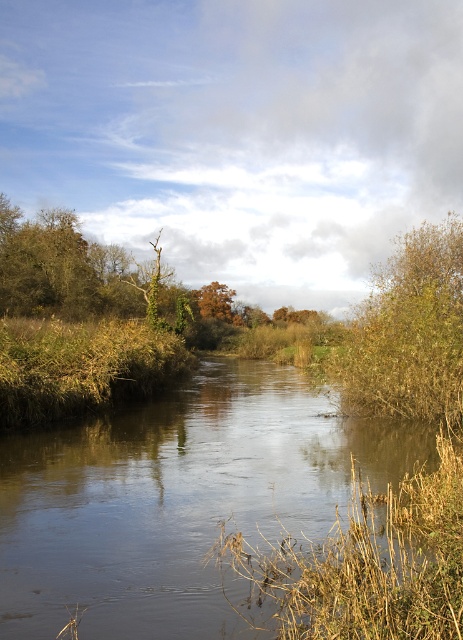
Question: Does brown textured bush at right appear over orange matte tree at center?

Choices:
 (A) yes
 (B) no

Answer: (B)

Question: Is brown textured bush at right smaller than orange matte tree at center?

Choices:
 (A) no
 (B) yes

Answer: (A)

Question: Which is nearer to the smooth brown water at center?

Choices:
 (A) orange matte tree at center
 (B) brown textured bush at right

Answer: (B)

Question: Which point is closer to the camera taking this photo?

Choices:
 (A) (405, 260)
 (B) (232, 586)
 (C) (224, 289)

Answer: (B)

Question: Is smooth brown water at center to the left of orange matte tree at center from the viewer's perspective?

Choices:
 (A) no
 (B) yes

Answer: (A)

Question: Which point is farther from the camera taking this photo?

Choices:
 (A) (457, 218)
 (B) (205, 298)
 (C) (344, 467)

Answer: (B)